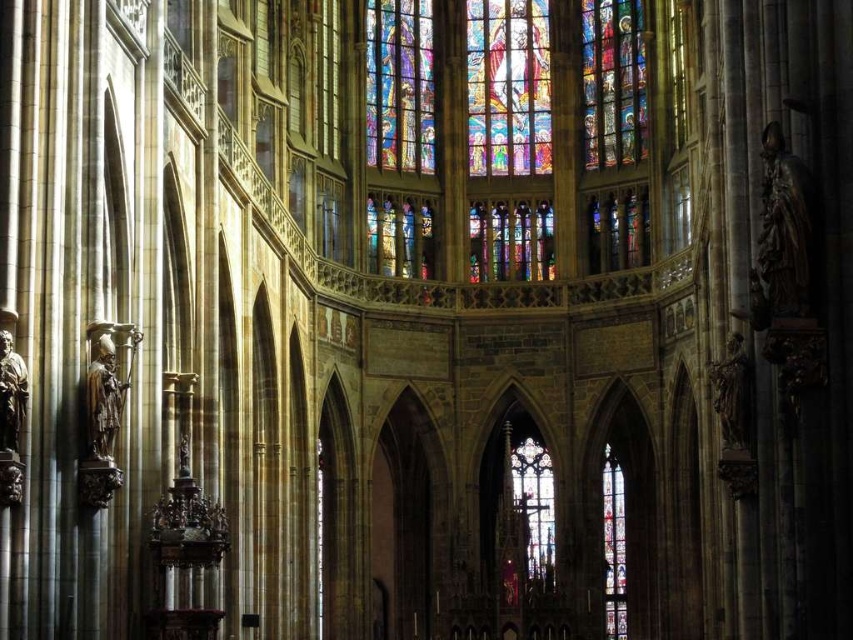
You are standing inside the grand cathedral and want to take a photo of the point at coordinates point (380, 157). If your camera has a maximum zoom range of 100 meters, will you be able to capture the point in your photo?

The distance between you and the point (380, 157) is 131.38 meters, which exceeds your camera maximum zoom range of 100 meters. Therefore, you will not be able to capture the point in your photo.